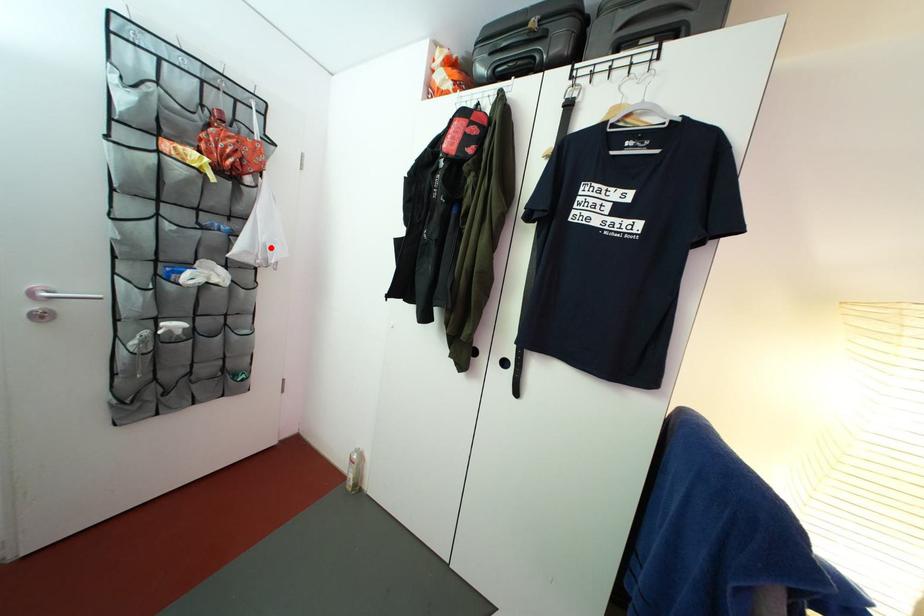
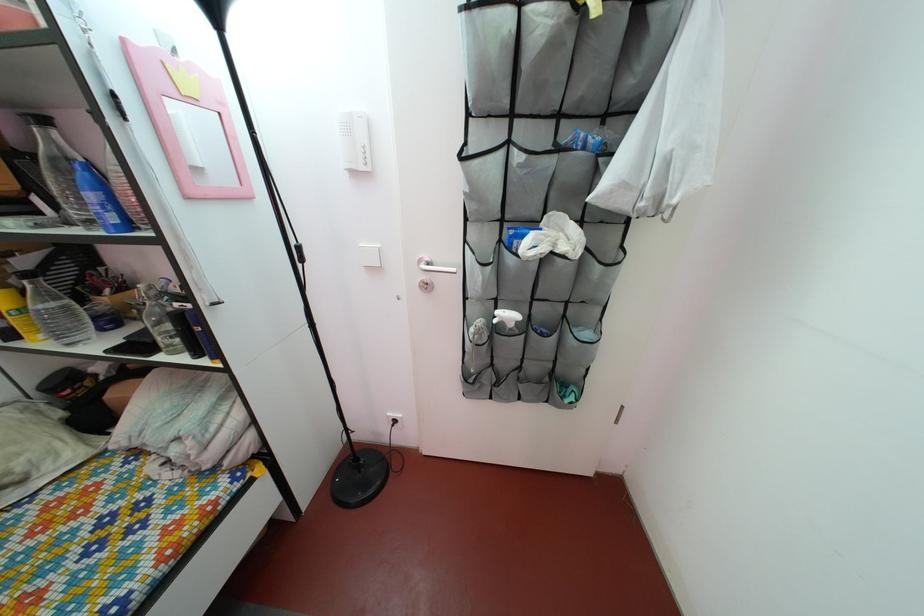
Where in the second image is the point corresponding to the highlighted location from the first image?

(675, 152)